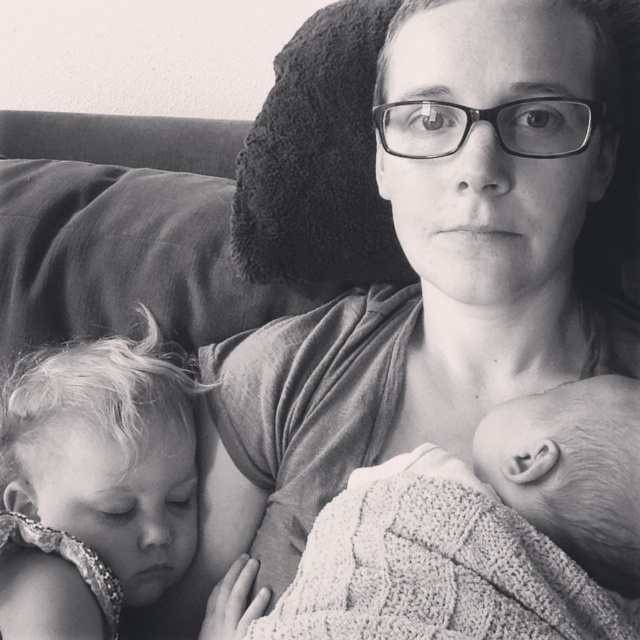
Based on the photo, who is more forward, (372, 106) or (458, 604)?

Point (458, 604)

Between matte gray shirt at center and knitted fabric baby at center, which one has more height?

Standing taller between the two is matte gray shirt at center.

Who is more distant from viewer, (x=298, y=371) or (x=541, y=429)?

The point (x=298, y=371) is behind.

Where is `matte gray shirt at center`? matte gray shirt at center is located at coordinates (426, 275).